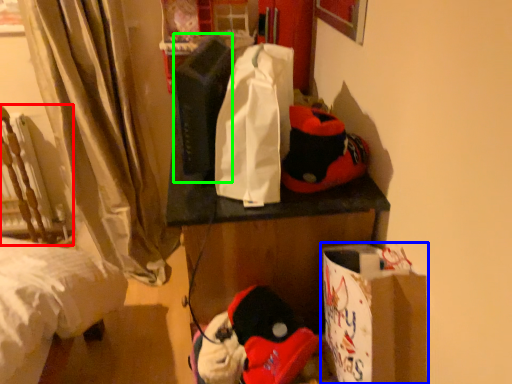
Question: Which object is the farthest from armchair (highlighted by a red box)? Choose among these: cardboard box (highlighted by a blue box) or twin (highlighted by a green box).

Choices:
 (A) cardboard box
 (B) twin

Answer: (A)